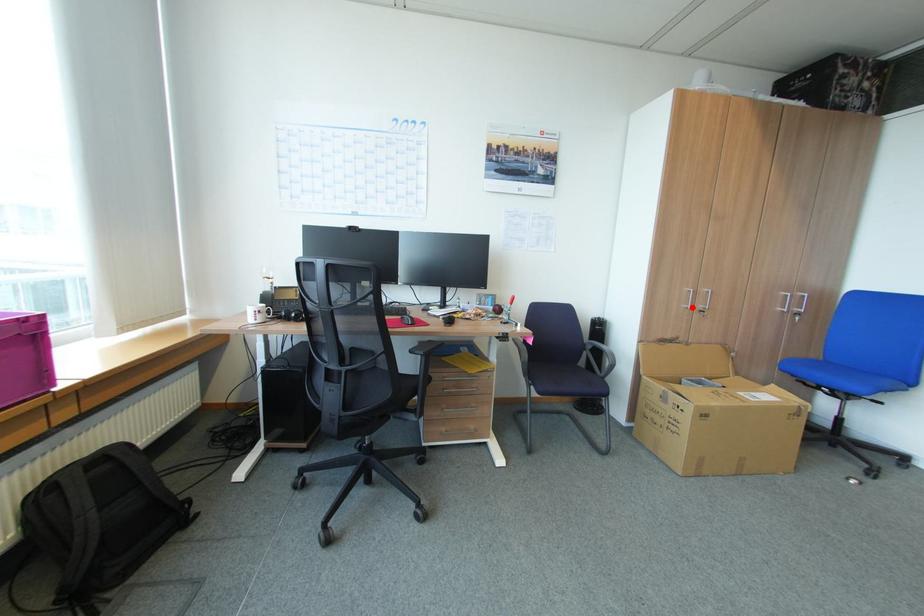
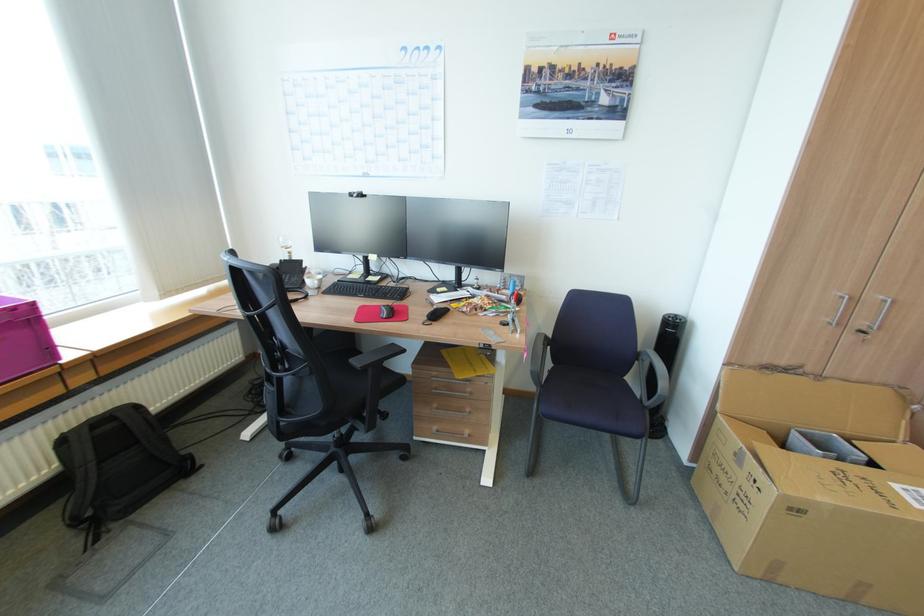
Find the pixel in the second image that matches the highlighted location in the first image.

(833, 323)